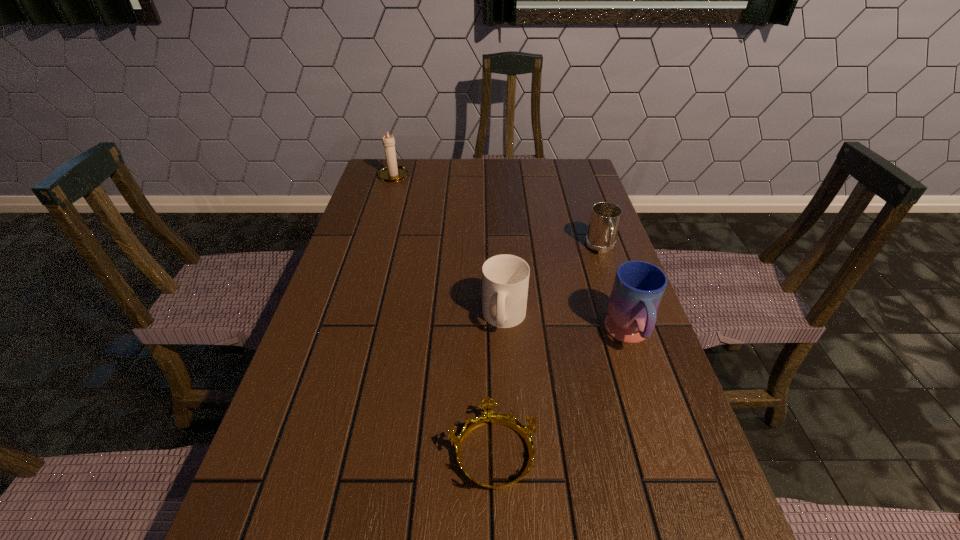
Locate an element on the screen. The height and width of the screenshot is (540, 960). the leftmost object is located at coordinates (392, 173).

You are a GUI agent. You are given a task and a screenshot of the screen. Output one action in this format:
    pyautogui.click(x=<x>, y=<y>)
    Task: Click on the farthest object
    Image resolution: width=960 pixels, height=540 pixels.
    Given the screenshot: What is the action you would take?
    pyautogui.click(x=392, y=173)

Where is `the leftmost mug`? The width and height of the screenshot is (960, 540). the leftmost mug is located at coordinates (505, 278).

Where is `the second farthest object`? This screenshot has width=960, height=540. the second farthest object is located at coordinates (605, 218).

Where is `the nearest object`? the nearest object is located at coordinates (488, 417).

The height and width of the screenshot is (540, 960). Find the location of `crown`. crown is located at coordinates (488, 417).

Identify the location of free space located 0.080m on the handle side of the leftmost mug. Image resolution: width=960 pixels, height=540 pixels. (507, 369).

Identify the location of vacant region located on the side of the second farthest object with the handle. This screenshot has height=540, width=960. (614, 287).

This screenshot has width=960, height=540. I want to click on vacant point located 0.400m on the back of the shortest object, so click(x=489, y=278).

Where is `object positioned at the far edge`? The width and height of the screenshot is (960, 540). object positioned at the far edge is located at coordinates (392, 173).